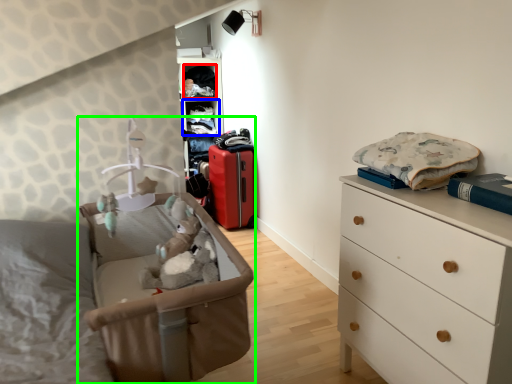
Question: Based on their relative distances, which object is nearer to clothing (highlighted by a red box)? Choose from shelf (highlighted by a blue box) and infant bed (highlighted by a green box).

Choices:
 (A) shelf
 (B) infant bed

Answer: (A)